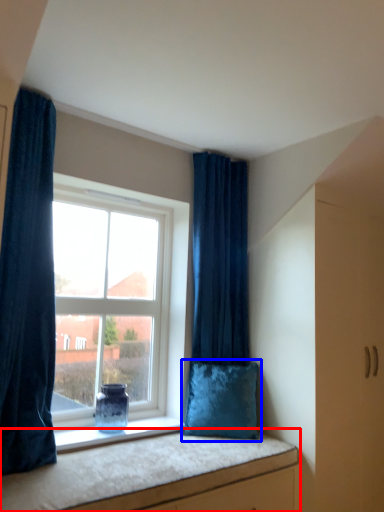
Question: Which object is closer to the camera taking this photo, vanity (highlighted by a red box) or pillow (highlighted by a blue box)?

Choices:
 (A) vanity
 (B) pillow

Answer: (A)